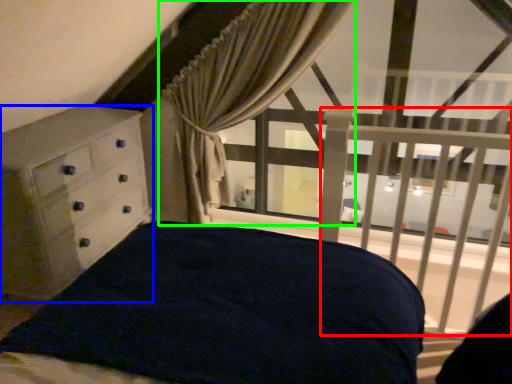
Question: Which is nearer to the balustrade (highlighted by a red box)? chest of drawers (highlighted by a blue box) or curtain (highlighted by a green box).

Choices:
 (A) chest of drawers
 (B) curtain

Answer: (B)